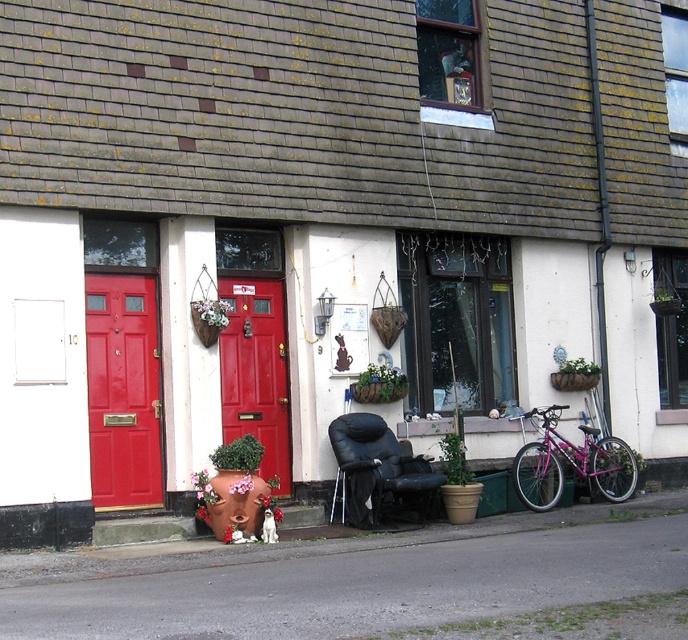
Question: Which point is closer to the camera?

Choices:
 (A) (224, 365)
 (B) (632, 481)

Answer: (A)

Question: Which point appears closest to the camera in this image?

Choices:
 (A) (546, 444)
 (B) (268, 451)
 (C) (150, 474)

Answer: (C)

Question: Is shiny red door at center below pink metallic bicycle at lower right?

Choices:
 (A) yes
 (B) no

Answer: (B)

Question: Is the position of matte red door at left less distant than that of shiny red door at center?

Choices:
 (A) no
 (B) yes

Answer: (B)

Question: Which of these objects is positioned farthest from the pink metallic bicycle at lower right?

Choices:
 (A) shiny red door at center
 (B) matte red door at left

Answer: (B)

Question: Is shiny red door at center wider than pink metallic bicycle at lower right?

Choices:
 (A) yes
 (B) no

Answer: (B)